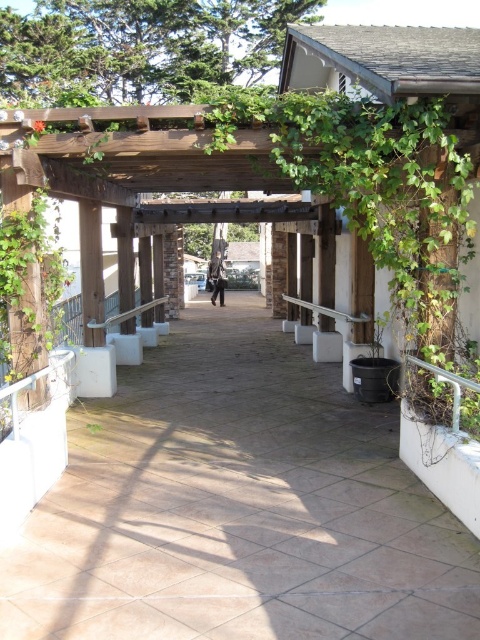
You are standing at the entrance of the covered walkway and want to reach the brown tile path at center. Based on the coordinates provided, in which direction should you walk to reach it?

The brown tile path at center is located at coordinates point (237, 506), which means it is positioned to the right and slightly forward from your current position at the entrance. You should walk towards the right and forward to reach it.

You are a delivery person carrying a large package and need to navigate through the corridor. The package is 1.2 meters wide. Can you fit the package through the corridor while staying on the brown tile path at center and keeping the silver metallic handrail at center on your left side?

The brown tile path at center is wider than the silver metallic handrail at center. Since the package is 1.2 meters wide, it should fit on the brown tile path at center as long as the path is wide enough to accommodate the package. However, the exact width of the path isn

You are walking along the covered walkway and want to step onto the brown tile path at center. Which direction should you move relative to the silver metallic handrail at center?

The brown tile path at center is positioned on the left side of the silver metallic handrail at center, so you should move to the left side of the silver metallic handrail at center to step onto it.